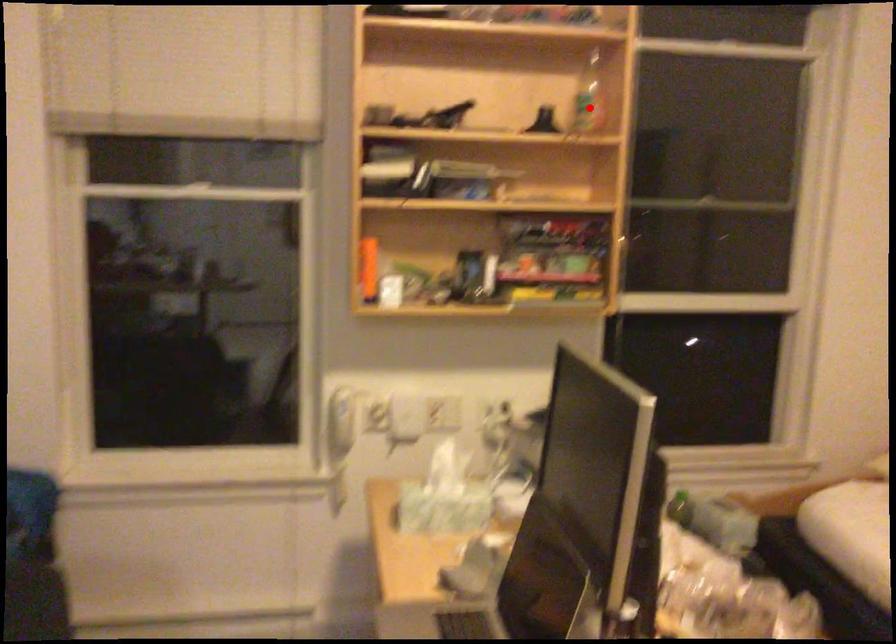
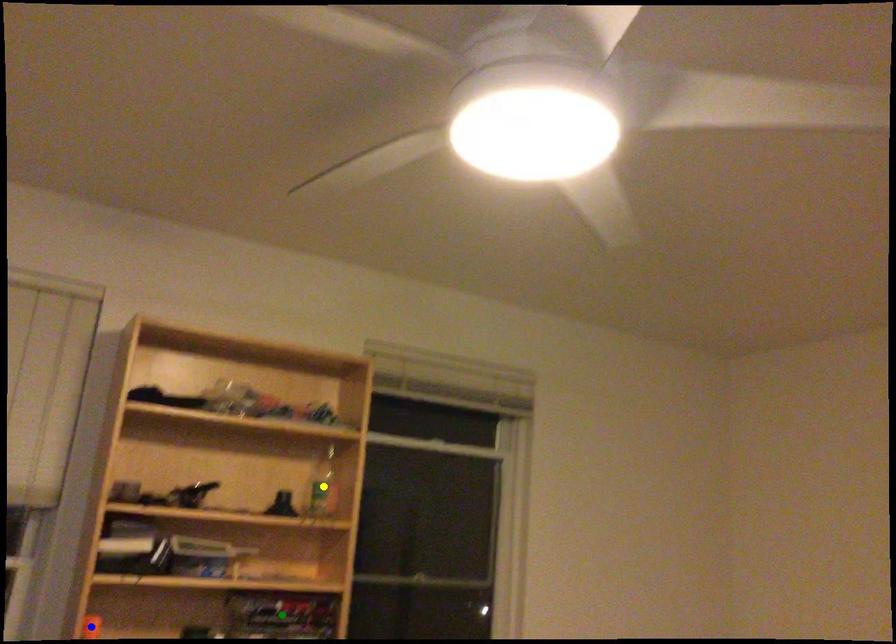
Question: I am providing you with two images of the same scene from different viewpoints. A red point is marked on the first image. You are given multiple points on the second image. Which point in image 2 is actually the same real-world point as the red point in image 1?

Choices:
 (A) blue point
 (B) yellow point
 (C) green point

Answer: (B)